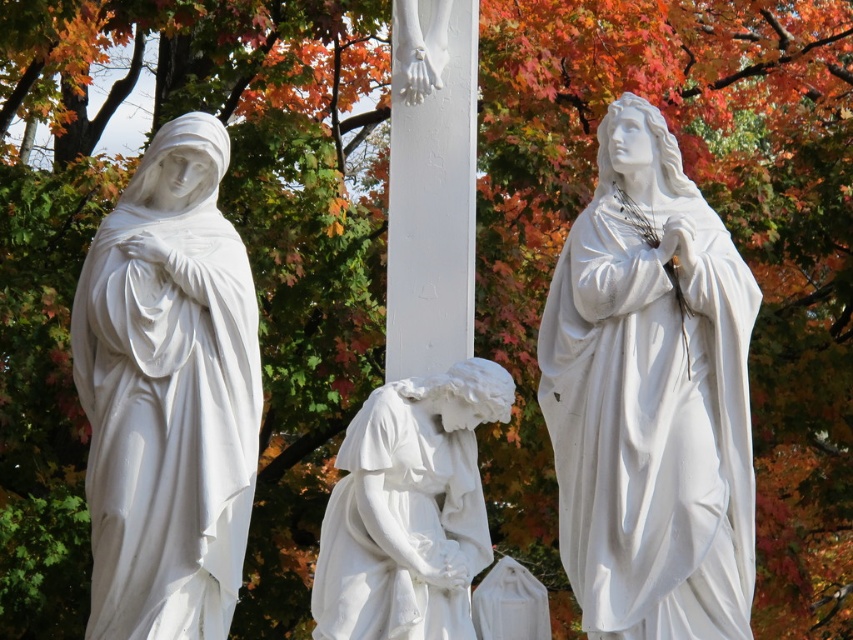
Question: Which point is closer to the camera taking this photo?

Choices:
 (A) (440, 572)
 (B) (126, 564)
 (C) (572, 490)

Answer: (B)

Question: Among these objects, which one is nearest to the camera?

Choices:
 (A) white marble statue at right
 (B) white marble statue at center

Answer: (A)

Question: Which point is closer to the camera?

Choices:
 (A) white marble statue at center
 (B) white marble statue at left

Answer: (B)

Question: Can you confirm if white marble statue at left is positioned below white marble statue at center?

Choices:
 (A) yes
 (B) no

Answer: (A)

Question: Where is white marble statue at right located in relation to white marble statue at left in the image?

Choices:
 (A) left
 (B) right

Answer: (B)

Question: Is white marble statue at right to the left of white marble statue at left from the viewer's perspective?

Choices:
 (A) no
 (B) yes

Answer: (A)